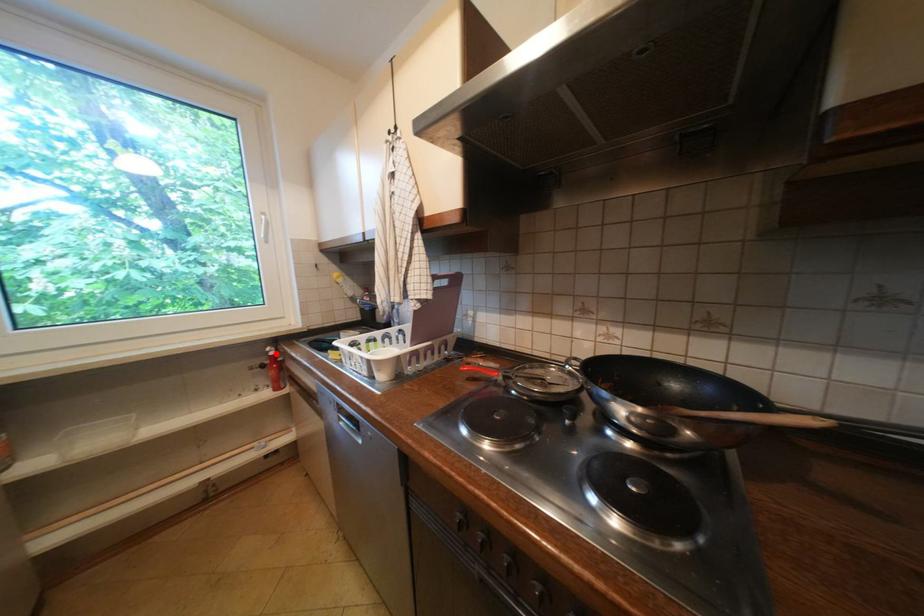
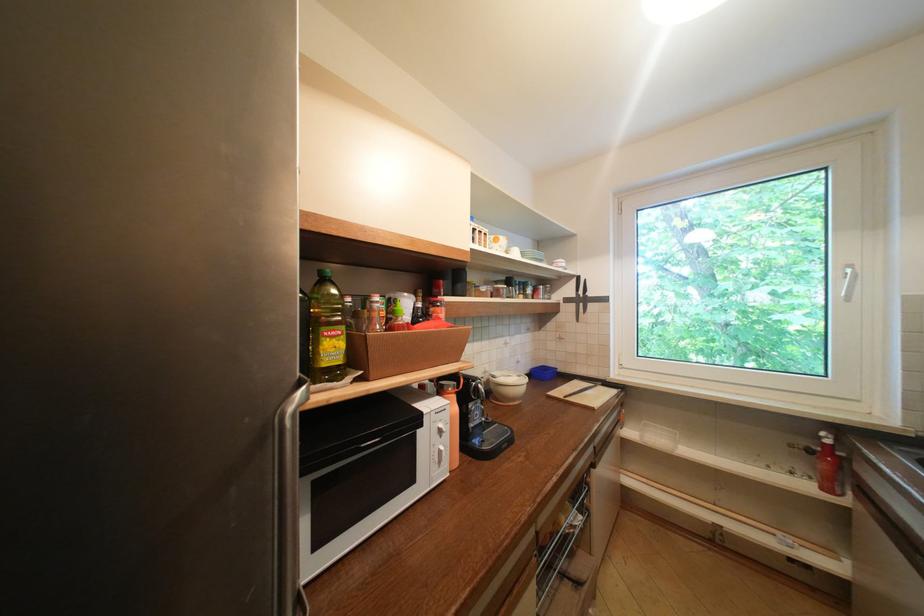
In the second image, find the point that corresponds to the highlighted location in the first image.

(829, 439)